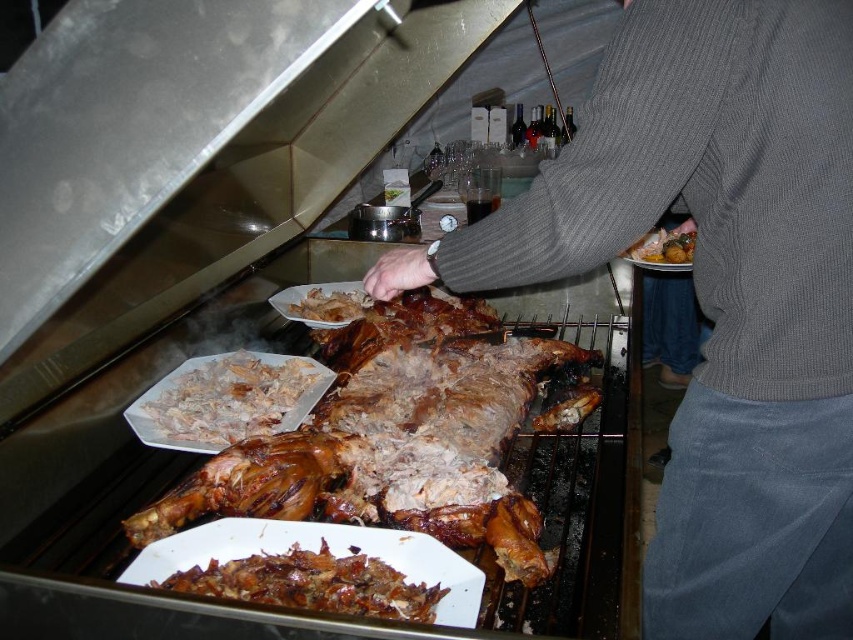
You are a chef preparing to serve a roasted meat dish. You have a gray ribbed sweater at center and brown crispy skin at center in your view. Can you easily reach both items at the same time while maintaining a comfortable working distance of 18 inches?

The gray ribbed sweater at center and brown crispy skin at center are 17.92 inches apart, which is just under the 18 inches comfortable working distance. Therefore, you can easily reach both items at the same time.

You are a chef preparing a dish and need to know the spatial arrangement of the ingredients. Which object is located below the other between the white shredded meat at lower left and the translucent white shredded food at center?

The white shredded meat at lower left is positioned under the translucent white shredded food at center.